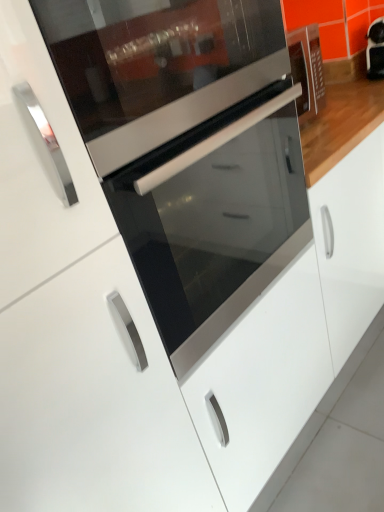
Where is `satin silver oven at center`? The width and height of the screenshot is (384, 512). satin silver oven at center is located at coordinates (158, 66).

Where is `satin silver oven at center`? The width and height of the screenshot is (384, 512). satin silver oven at center is located at coordinates (158, 66).

From a real-world perspective, is glossy white cabinet at center on top of matte black oven at center?

No, from a real-world perspective, glossy white cabinet at center is not over matte black oven at center

Consider the image. Is glossy white cabinet at center turned away from matte black oven at center?

glossy white cabinet at center does not have its back to matte black oven at center.

Is glossy white cabinet at center inside or outside of matte black oven at center?

glossy white cabinet at center is spatially situated outside matte black oven at center.

Is glossy white cabinet at center positioned far away from matte black oven at center?

That's not correct — glossy white cabinet at center is a little close to matte black oven at center.

Is matte black oven at center facing away from glossy white cabinet at center?

matte black oven at center does not have its back to glossy white cabinet at center.

From the image's perspective, which one is positioned lower, matte black oven at center or glossy white cabinet at center?

From the image's view, glossy white cabinet at center is below.

Is matte black oven at center bigger or smaller than glossy white cabinet at center?

In the image, matte black oven at center appears to be smaller than glossy white cabinet at center.

Considering the relative sizes of matte black oven at center and glossy white cabinet at center in the image provided, is matte black oven at center shorter than glossy white cabinet at center?

Yes, matte black oven at center is shorter than glossy white cabinet at center.

Considering the points (57, 429) and (230, 42), which point is in front, point (57, 429) or point (230, 42)?

The point (57, 429) is closer to the camera.

Considering the positions of objects glossy white cabinet at center and satin silver oven at center in the image provided, who is behind, glossy white cabinet at center or satin silver oven at center?

glossy white cabinet at center is further away from the camera.

The width and height of the screenshot is (384, 512). Identify the location of appliance above the glossy white cabinet at center (from the image's perspective). (158, 66).

From the image's perspective, which one is positioned higher, glossy white cabinet at center or satin silver oven at center?

satin silver oven at center is shown above in the image.

From the image's perspective, is matte black oven at center under satin silver oven at center?

Indeed, from the image's perspective, matte black oven at center is shown beneath satin silver oven at center.

Is matte black oven at center at the left side of satin silver oven at center?

No.

Considering the relative sizes of matte black oven at center and satin silver oven at center in the image provided, is matte black oven at center taller than satin silver oven at center?

Yes, matte black oven at center is taller than satin silver oven at center.

Is point (166, 225) positioned before point (242, 24)?

No, (166, 225) is behind (242, 24).

Between point (142, 90) and point (216, 337), which one is positioned in front?

Point (142, 90)

Find the location of a particular element. This screenshot has height=512, width=384. oven below the satin silver oven at center (from a real-world perspective) is located at coordinates (215, 219).

Is satin silver oven at center positioned far away from matte black oven at center?

No, satin silver oven at center is not far away from matte black oven at center.

Is satin silver oven at center wider or thinner than matte black oven at center?

In the image, satin silver oven at center appears to be more narrow than matte black oven at center.

Is satin silver oven at center oriented towards glossy white cabinet at center?

No, satin silver oven at center is not turned towards glossy white cabinet at center.

Is satin silver oven at center taller or shorter than glossy white cabinet at center?

In the image, satin silver oven at center appears to be shorter than glossy white cabinet at center.

Identify the location of cabinetry on the right of satin silver oven at center. Image resolution: width=384 pixels, height=512 pixels. (93, 402).

Is satin silver oven at center touching glossy white cabinet at center?

No, satin silver oven at center is not beside glossy white cabinet at center.

Where is `cabinetry that appears on the right of matte black oven at center`? cabinetry that appears on the right of matte black oven at center is located at coordinates (93, 402).

Identify the location of cabinetry directly beneath the matte black oven at center (from a real-world perspective). Image resolution: width=384 pixels, height=512 pixels. (93, 402).

Which object lies further to the anchor point satin silver oven at center, glossy white cabinet at center or matte black oven at center?

glossy white cabinet at center is further to satin silver oven at center.

From the image, which object appears to be farther from matte black oven at center, satin silver oven at center or glossy white cabinet at center?

glossy white cabinet at center is further to matte black oven at center.

Based on their spatial positions, is glossy white cabinet at center or satin silver oven at center closer to matte black oven at center?

The object closer to matte black oven at center is satin silver oven at center.

From the image, which object appears to be nearer to satin silver oven at center, matte black oven at center or glossy white cabinet at center?

Based on the image, matte black oven at center appears to be nearer to satin silver oven at center.

From the image, which object appears to be farther from glossy white cabinet at center, satin silver oven at center or matte black oven at center?

satin silver oven at center.

Consider the image. From the image, which object appears to be farther from glossy white cabinet at center, matte black oven at center or satin silver oven at center?

satin silver oven at center is positioned further to the anchor glossy white cabinet at center.

Find the location of a particular element. The height and width of the screenshot is (512, 384). oven between satin silver oven at center and glossy white cabinet at center in the vertical direction is located at coordinates (215, 219).